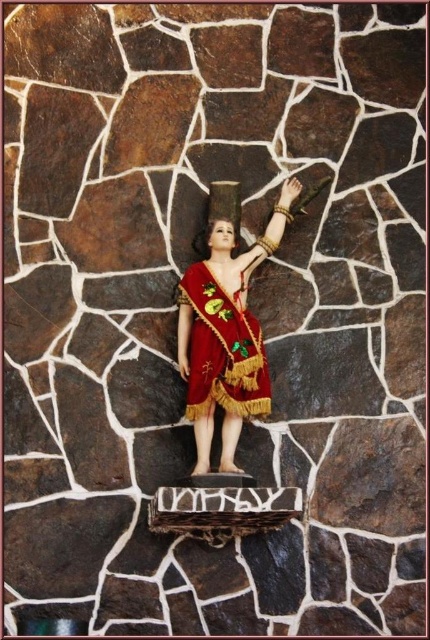
Does shiny red fabric doll at center lie behind velvet-like maroon cape at center?

No, shiny red fabric doll at center is closer to the viewer.

Which of these two, shiny red fabric doll at center or velvet-like maroon cape at center, stands taller?

shiny red fabric doll at center

Who is more distant from viewer, [224,444] or [199,307]?

Positioned behind is point [199,307].

Locate an element on the screen. shiny red fabric doll at center is located at coordinates (226, 332).